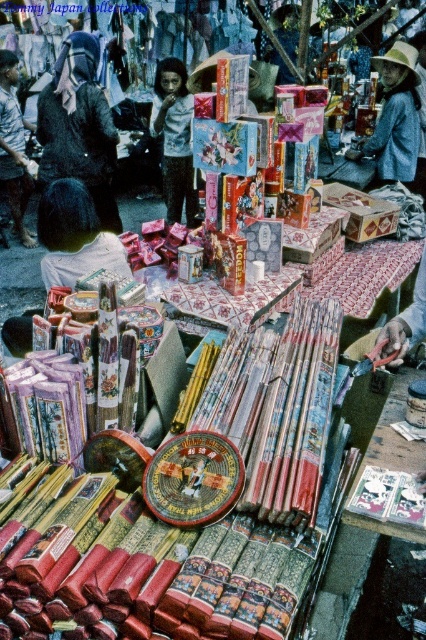
Based on the photo, who is positioned more to the left, light blue shirt at center or dark blue fabric at center?

From the viewer's perspective, dark blue fabric at center appears more on the left side.

Between light blue shirt at center and dark blue fabric at center, which one appears on the right side from the viewer's perspective?

light blue shirt at center is more to the right.

Which is behind, point (164, 124) or point (9, 150)?

Positioned behind is point (9, 150).

What are the coordinates of `light blue shirt at center` in the screenshot? It's located at (175, 138).

Does dark brown leather jacket at upper left appear under light blue shirt at center?

Yes, dark brown leather jacket at upper left is below light blue shirt at center.

Where is `dark brown leather jacket at upper left`? Image resolution: width=426 pixels, height=640 pixels. dark brown leather jacket at upper left is located at coordinates (78, 125).

At what (x,y) coordinates should I click in order to perform the action: click on dark brown leather jacket at upper left. Please return your answer as a coordinate pair (x, y). Looking at the image, I should click on (78, 125).

Is blue denim jacket at upper right in front of dark blue fabric at center?

Yes, blue denim jacket at upper right is in front of dark blue fabric at center.

Is blue denim jacket at upper right wider than dark blue fabric at center?

No, blue denim jacket at upper right is not wider than dark blue fabric at center.

Does point (391, 54) come behind point (14, 138)?

No, it is not.

Identify the location of blue denim jacket at upper right. (394, 116).